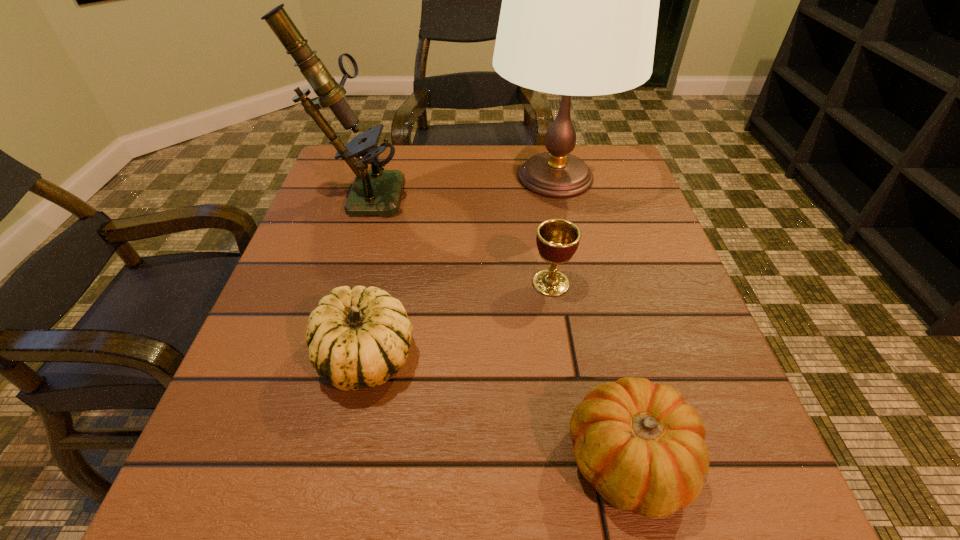
Image resolution: width=960 pixels, height=540 pixels. Identify the location of object that is at the near right corner. (640, 444).

In the image, there is a desktop. Find the location of `vacant space at the far edge`. vacant space at the far edge is located at coordinates (485, 168).

Find the location of a particular element. The height and width of the screenshot is (540, 960). blank area at the left edge is located at coordinates (294, 431).

Locate an element on the screen. free space at the far left corner is located at coordinates (351, 176).

You are a GUI agent. You are given a task and a screenshot of the screen. Output one action in this format:
    pyautogui.click(x=<x>, y=<y>)
    Task: Click on the vacant space at the near left corner of the desktop
    This screenshot has height=540, width=960.
    Given the screenshot: What is the action you would take?
    pyautogui.click(x=227, y=473)

Where is `vacant region at the far right corner`? This screenshot has height=540, width=960. vacant region at the far right corner is located at coordinates pos(599,155).

Find the location of `free point between the tallest object and the fourth shortest object`. free point between the tallest object and the fourth shortest object is located at coordinates pos(458,185).

What are the coordinates of `free space between the taller gourd and the fourth shortest object` in the screenshot? It's located at (363, 275).

Where is `vacant area between the right gourd and the lamp`? vacant area between the right gourd and the lamp is located at coordinates (592, 319).

The width and height of the screenshot is (960, 540). What are the coordinates of `free space between the left gourd and the lamp` in the screenshot? It's located at (461, 267).